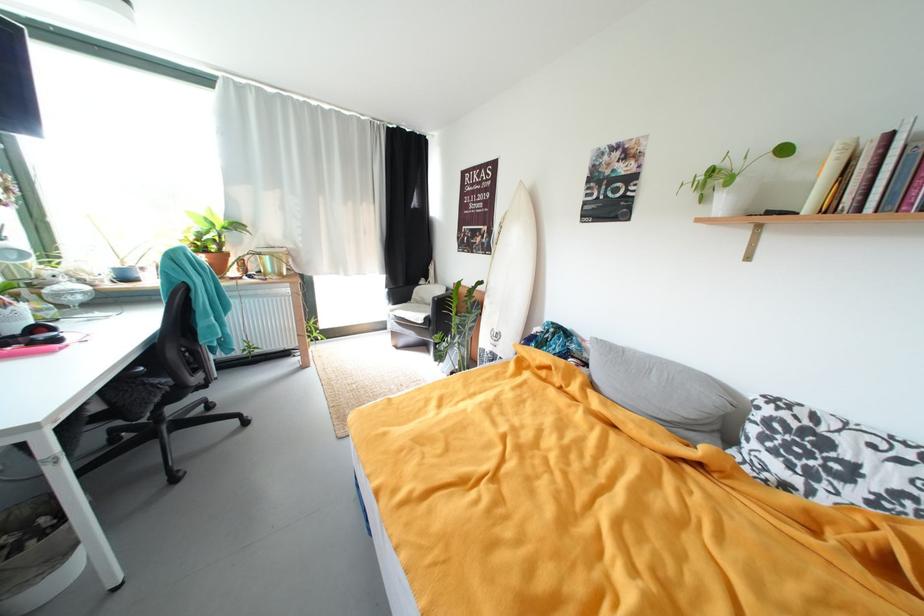
At what (x,y) coordinates should I click in order to perform the action: click on black chair armrest. Please return your answer as a coordinate pair (x, y). Looking at the image, I should click on (184, 301).